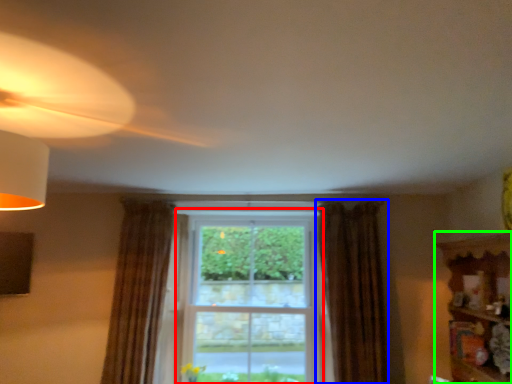
Question: Which object is positioned farthest from bay window (highlighted by a red box)? Select from curtain (highlighted by a blue box) and shelf (highlighted by a green box).

Choices:
 (A) curtain
 (B) shelf

Answer: (B)